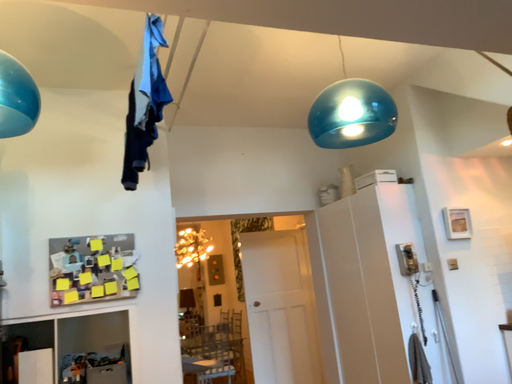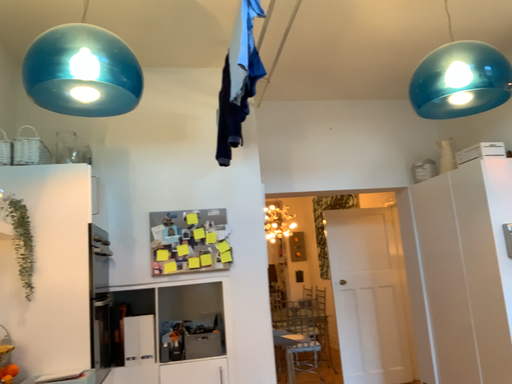
Question: How did the camera likely rotate when shooting the video?

Choices:
 (A) rotated left
 (B) rotated right

Answer: (A)